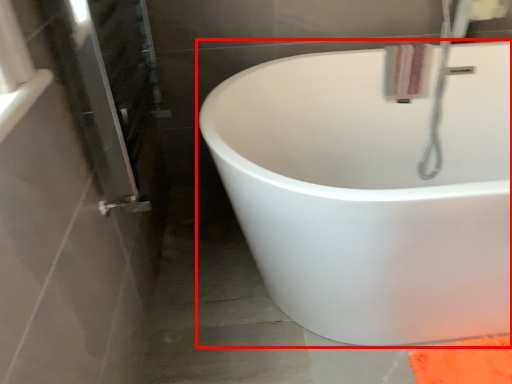
Question: From the image's perspective, what is the correct spatial relationship of bathtub (annotated by the red box) in relation to bath towel?

Choices:
 (A) above
 (B) below

Answer: (B)